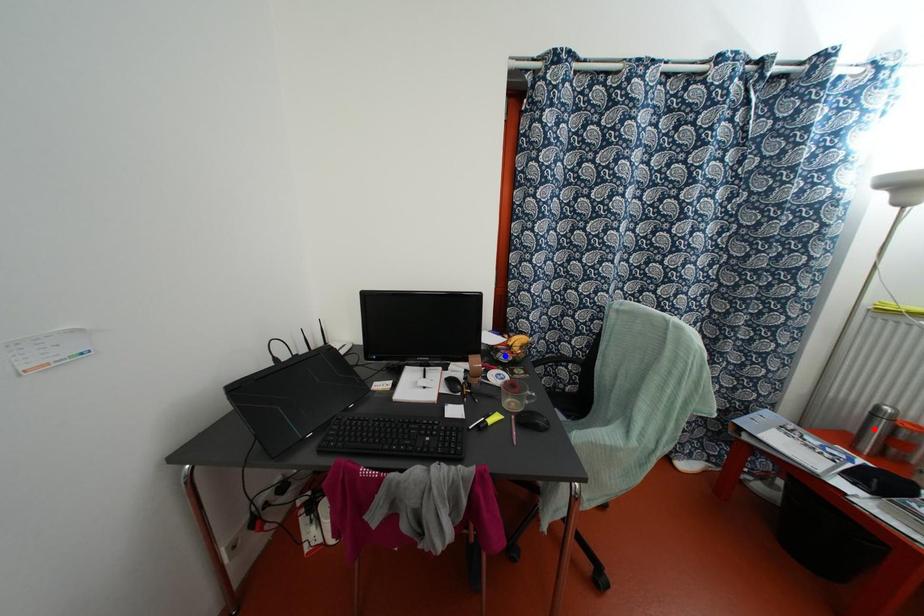
Question: In the image, two points are highlighted. Which point is nearer to the camera? Reply with the corresponding letter.

Choices:
 (A) blue point
 (B) red point

Answer: (B)